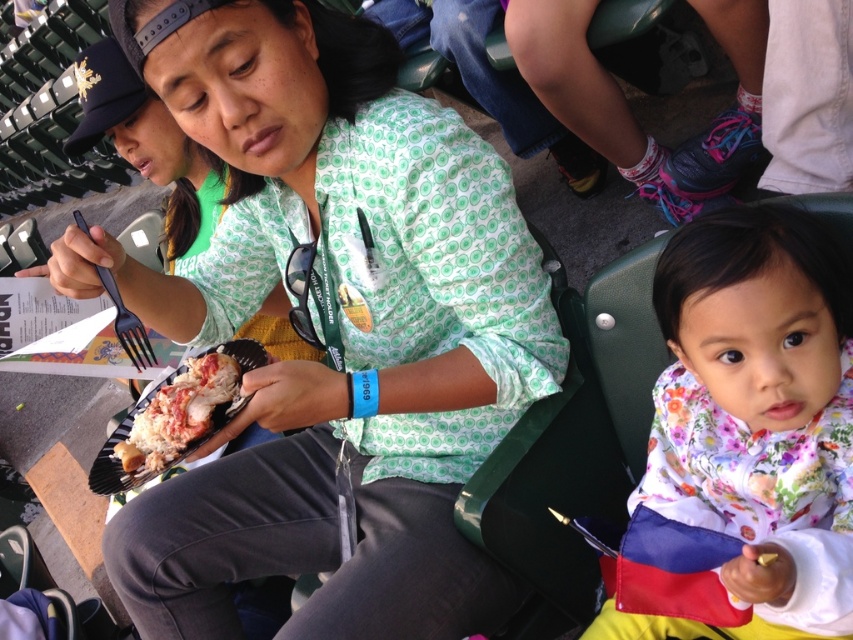
You are a food critic sitting at a table with a shiny lobster at center and a black plastic fork at center. You want to take a bite of the lobster. Which object should you move first?

The shiny lobster at center is further to the viewer than the black plastic fork at center, so you should move the shiny lobster at center first to access the fork.

You are a food critic attending a seafood festival and see the shiny lobster at center and the black plastic fork at center on the plate. Which item is smaller in size?

The shiny lobster at center is smaller in size compared to the black plastic fork at center.

What is located at the coordinates point (339, 326)?

The coordinates point (339, 326) is occupied by the matte green shirt at center.